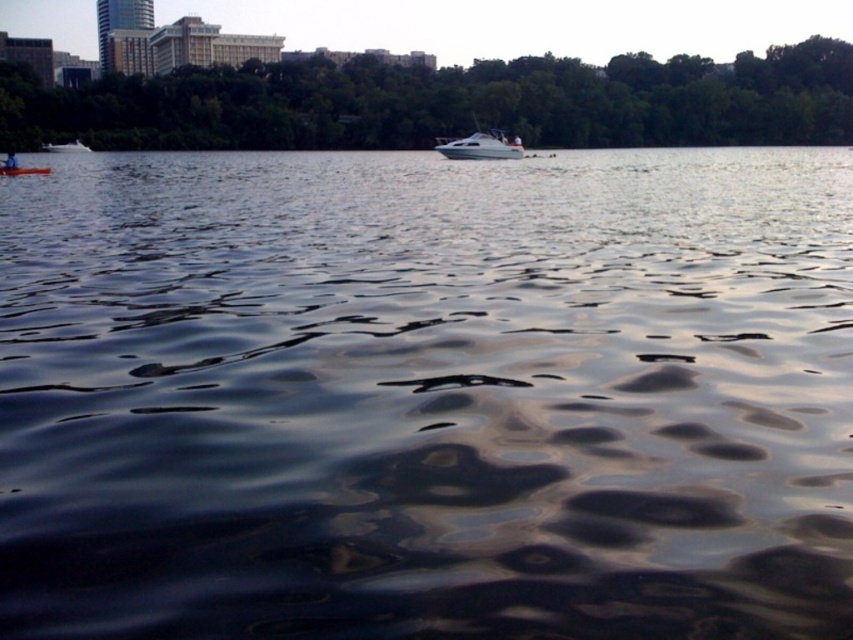
You are planning to take a photo of the orange plastic kayak at lower left and the green leafy trees at upper center. Which object should you zoom in more on to make them appear equally sized in the photo?

To make the orange plastic kayak at lower left and the green leafy trees at upper center appear equally sized in the photo, you should zoom in more on the green leafy trees at upper center since it is larger in size than the orange plastic kayak at lower left.

You are standing at the point marked by the coordinates point (448, 104) in the image. Looking around, you see the green leafy trees at upper center. Which direction should you face to look towards the green leafy trees at upper center?

→ Since the point (448, 104) is where the green leafy trees at upper center are located, you are already facing them. Therefore, you should face forward to look towards the green leafy trees at upper center.

You are standing on the orange plastic kayak at lower left and want to reach the green leafy trees at upper center. Based on the distance provided, can you estimate how long it would take to paddle there if your average speed is 2 meters per second?

The distance between the green leafy trees at upper center and orange plastic kayak at lower left is 100.38 meters. At an average speed of 2 meters per second, it would take approximately 50.19 seconds to paddle there.